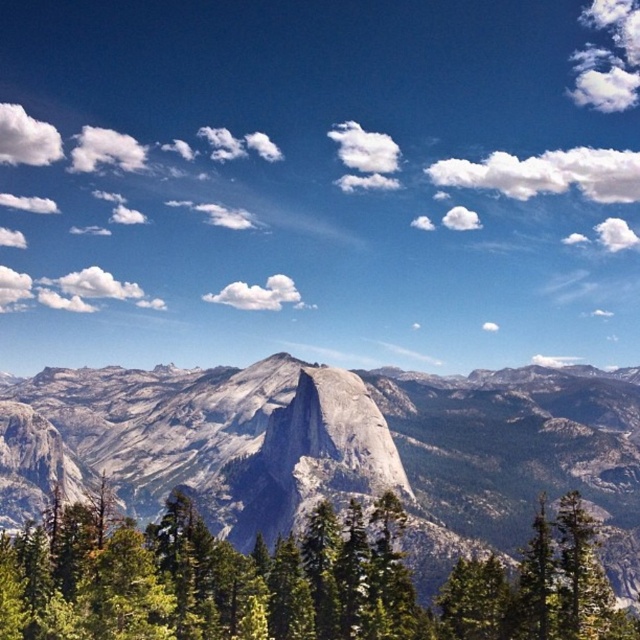
You are a hiker planning to take a photo of the granite mountain range at center and the green matte tree at lower right together in the frame. Based on their distance, can you estimate whether they can both fit into a standard camera frame with a 50mm lens?

The granite mountain range at center and green matte tree at lower right are 151.18 meters apart. With a 50mm lens, which has a moderate field of view, it might be challenging to capture both objects in the same frame if they are 151.18 meters apart, as the distance between them may exceed the lens field of view. However, this depends on the camera sensor size and shooting distance. To ensure both are in frame, you might need to use a wider lens or adjust your position closer to the subjects.

Based on the scene description, where is the granite mountain range at center located in the image?

The granite mountain range at center is located at point (337, 449).